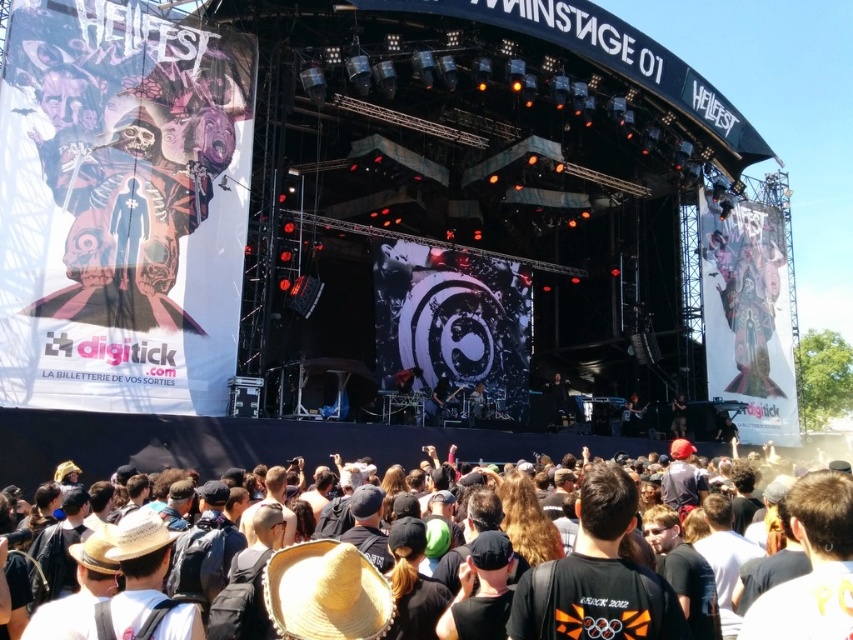
You are standing at the Hellfest festival and see two points in the crowd. The first point is at coordinate (x=708, y=305) and the second is at (x=624, y=435). Which point is closer to you?

Point (x=708, y=305) is further to the viewer than point (x=624, y=435), so the second point is closer to you.

You are a photographer at the Hellfest festival and need to place a new banner between the matte black poster at upper right and the dark brown leather guitar at lower right. Based on their sizes, which object should you consider for positioning the banner to ensure it fits properly?

→ The matte black poster at upper right might be wider than dark brown leather guitar at lower right, so positioning the banner near the matte black poster at upper right would be more appropriate to accommodate its width.

You are a photographer standing at the camera position. You want to capture a closeup of the crowd without moving closer. What is the minimum focal length lens you need to use to fill the frame with the black fabric crowd at lower center?

To capture the black fabric crowd at lower center with a closeup, you need a lens with a focal length of at least 30.74 meters.